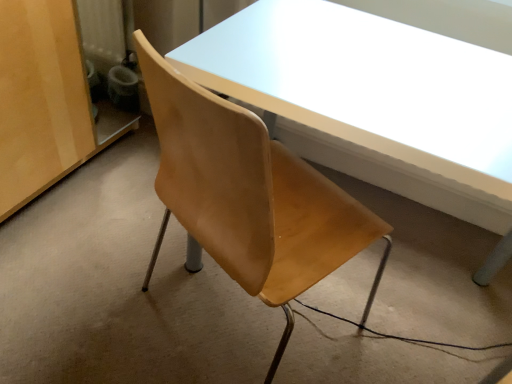
Find the location of `free point below matte white table at center (from a real-world perspective)`. free point below matte white table at center (from a real-world perspective) is located at coordinates (404, 309).